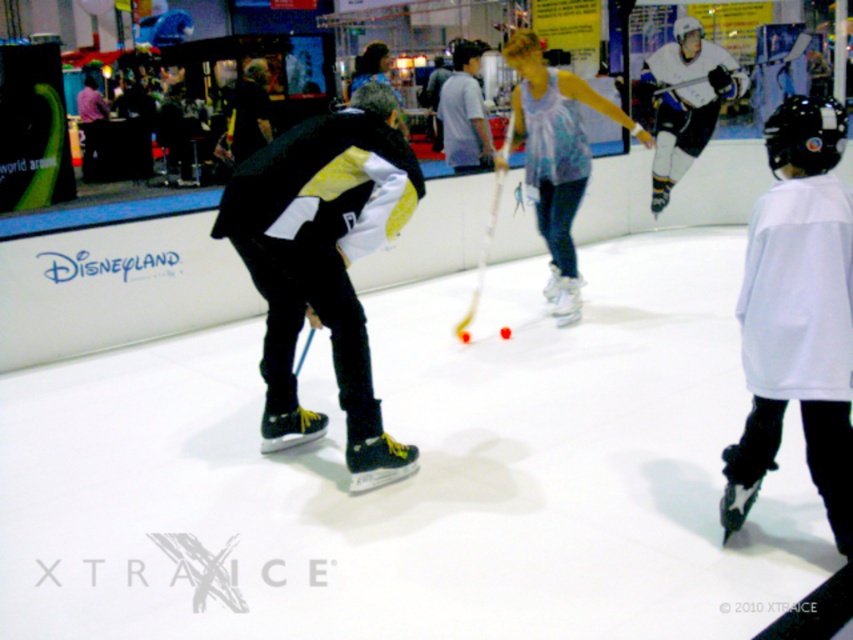
You are standing at the point with coordinates point (460, 337) in the ice rink scene. You want to move to the point with coordinates point (556, 150). Is the destination point behind you or in front of you?

The destination point point (556, 150) is behind the starting point point (460, 337), so it is behind you.

Based on the photo, you are a photographer at the ice rink. You need to capture a photo where the black matte hockey stick at center is visible without being blocked. Since the light blue fabric shirt at center is currently in the way, where should you position yourself relative to the shirt to ensure the hockey stick is visible?

The black matte hockey stick at center is positioned under the light blue fabric shirt at center. To capture the hockey stick without obstruction, position yourself below the light blue fabric shirt at center so you can see under it.